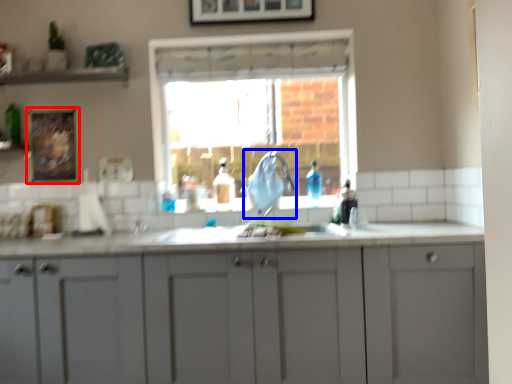
Question: Among these objects, which one is nearest to the camera, picture frame (highlighted by a red box) or faucet (highlighted by a blue box)?

Choices:
 (A) picture frame
 (B) faucet

Answer: (B)